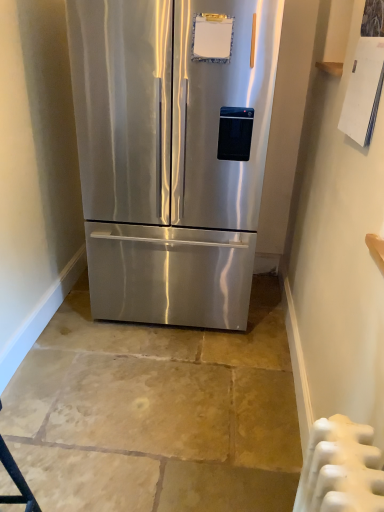
Question: Should I look upward or downward to see stainless steel refrigerator at center?

Choices:
 (A) up
 (B) down

Answer: (A)

Question: Does white plastic radiator at lower right have a lesser height compared to stainless steel refrigerator at center?

Choices:
 (A) yes
 (B) no

Answer: (A)

Question: Is white plastic radiator at lower right at the left side of stainless steel refrigerator at center?

Choices:
 (A) no
 (B) yes

Answer: (A)

Question: Is stainless steel refrigerator at center a part of white plastic radiator at lower right?

Choices:
 (A) no
 (B) yes

Answer: (A)

Question: Are white plastic radiator at lower right and stainless steel refrigerator at center far apart?

Choices:
 (A) yes
 (B) no

Answer: (A)

Question: Is white plastic radiator at lower right bigger than stainless steel refrigerator at center?

Choices:
 (A) no
 (B) yes

Answer: (A)

Question: From a real-world perspective, is white plastic radiator at lower right located higher than stainless steel refrigerator at center?

Choices:
 (A) no
 (B) yes

Answer: (A)

Question: Can you confirm if stainless steel refrigerator at center is positioned to the left of white plastic radiator at lower right?

Choices:
 (A) yes
 (B) no

Answer: (A)

Question: Is white plastic radiator at lower right at the back of stainless steel refrigerator at center?

Choices:
 (A) no
 (B) yes

Answer: (A)

Question: Considering the relative positions of stainless steel refrigerator at center and white plastic radiator at lower right in the image provided, is stainless steel refrigerator at center behind white plastic radiator at lower right?

Choices:
 (A) no
 (B) yes

Answer: (B)

Question: From a real-world perspective, does stainless steel refrigerator at center sit lower than white plastic radiator at lower right?

Choices:
 (A) no
 (B) yes

Answer: (A)

Question: Is stainless steel refrigerator at center smaller than white plastic radiator at lower right?

Choices:
 (A) no
 (B) yes

Answer: (A)

Question: From the image's perspective, is stainless steel refrigerator at center located beneath white plastic radiator at lower right?

Choices:
 (A) no
 (B) yes

Answer: (A)

Question: Is stainless steel refrigerator at center in front of or behind white plastic radiator at lower right in the image?

Choices:
 (A) behind
 (B) front

Answer: (A)